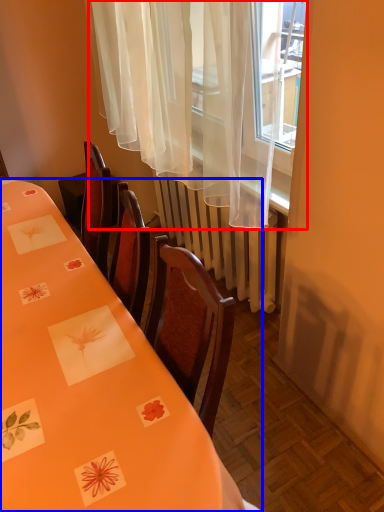
Question: Which object appears farthest to the camera in this image, curtain (highlighted by a red box) or table (highlighted by a blue box)?

Choices:
 (A) curtain
 (B) table

Answer: (A)